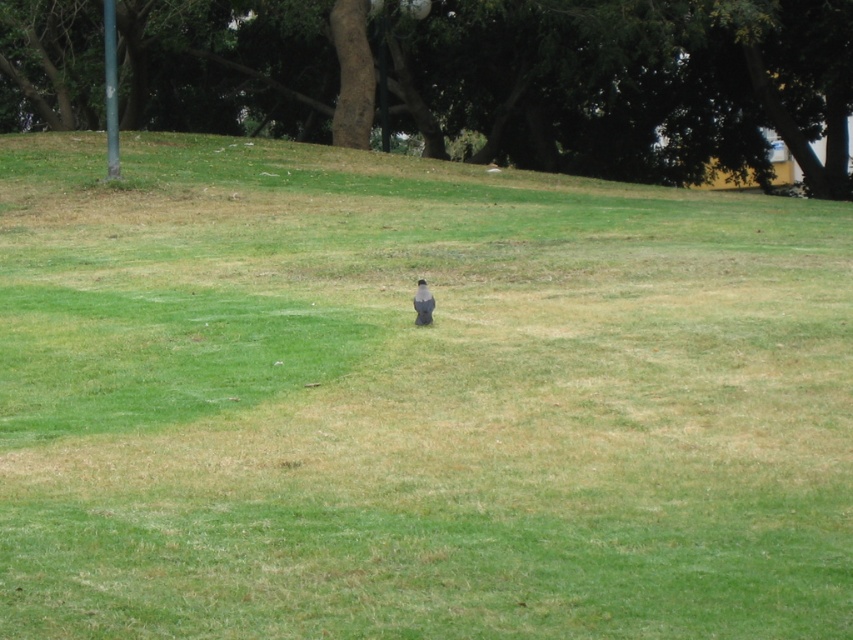
You are a birdwatcher trying to photograph the gray matte bird at center. You notice a brown textured tree at upper center in the background. Which object is wider when viewed from your position?

The brown textured tree at upper center is wider than the gray matte bird at center when viewed from your position.

You are a photographer trying to capture the gray matte bird at center. You need to ensure the brown textured tree at upper center doesn

The brown textured tree at upper center is larger in size than the gray matte bird at center, so it may block the view of the bird if positioned directly between them. Adjust your angle to avoid the tree obstructing the bird.